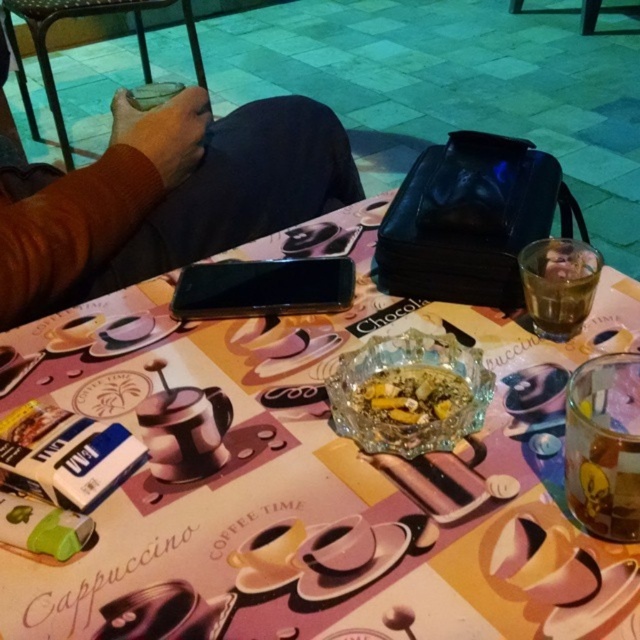
You are standing at the edge of the patio and want to place a small decorative item exactly at the location marked by the translucent glass cup at lower right. According to the coordinates provided, where should you place it?

The translucent glass cup at lower right is located at coordinates point (600, 472), so you should place the item there.

You are a waiter at the outdoor cafe and need to retrieve the matte plastic phone at upper center and the translucent glass at upper right to clean the table. Which object should you pick up first to avoid knocking over the other?

You should pick up the translucent glass at upper right first because the matte plastic phone at upper center is located above it, so moving the glass first prevents disturbing the phone.

You are a customer at the outdoor cafe and want to place your phone horizontally on the table without overlapping any other items. Given the table has limited space, can the matte plastic phone at upper center fit next to the translucent glass bowl at center based on their widths?

Answer: The matte plastic phone at upper center is wider than the translucent glass bowl at center, so placing the phone next to the bowl might not leave enough space since the phone takes up more width. Check the available space carefully.